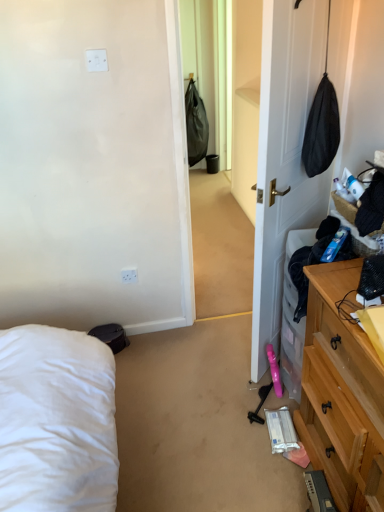
Question: Is white matte door at center taller or shorter than white plastic electric outlet at upper center?

Choices:
 (A) short
 (B) tall

Answer: (B)

Question: From the image's perspective, relative to white plastic electric outlet at upper center, is white matte door at center above or below?

Choices:
 (A) below
 (B) above

Answer: (B)

Question: Estimate the real-world distances between objects in this image. Which object is closer to the white plastic electric outlet at upper center?

Choices:
 (A) light wood dresser at right
 (B) white matte door at center

Answer: (B)

Question: Estimate the real-world distances between objects in this image. Which object is closer to the white matte door at center?

Choices:
 (A) light wood dresser at right
 (B) white plastic electric outlet at upper center

Answer: (A)